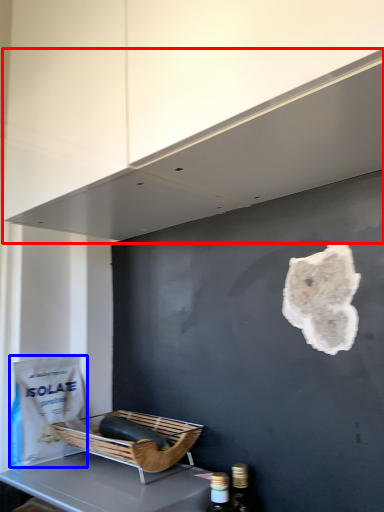
Question: Which object appears closest to the camera in this image, exhaust hood (highlighted by a red box) or paper bag (highlighted by a blue box)?

Choices:
 (A) exhaust hood
 (B) paper bag

Answer: (A)